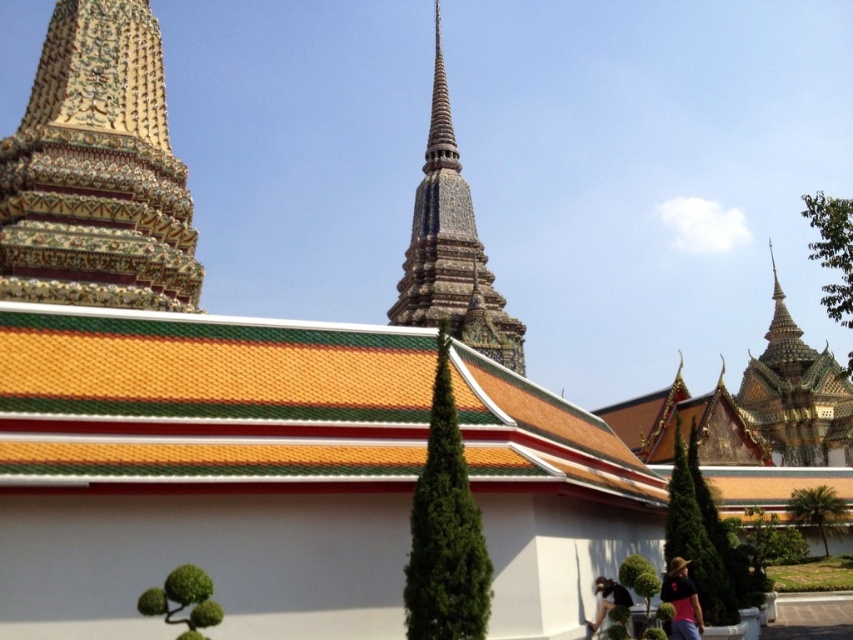
You are an architect analyzing the temple complex. You need to determine which object is taller between the golden mosaic temple at upper left and the black fabric at lower right. Based on the scene, what can you conclude?

The golden mosaic temple at upper left is taller than the black fabric at lower right.

You are standing in the temple complex and want to take a photo of the polished stone spire at center and the black fabric at lower right. Which object should you focus on first to ensure both are in the frame?

You should focus on the polished stone spire at center first because it is closer to you than the black fabric at lower right, so adjusting the frame to include it will also include the farther object.